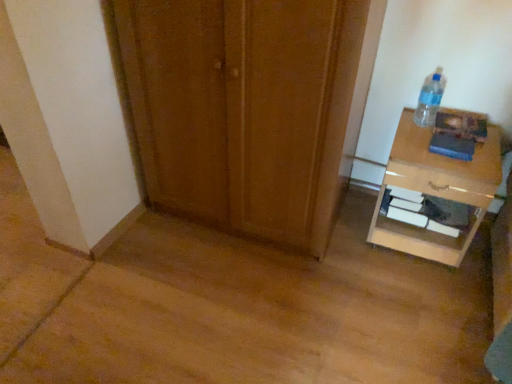
Question: From a real-world perspective, is clear plastic bottle at upper right located beneath light brown glossy nightstand at right?

Choices:
 (A) no
 (B) yes

Answer: (A)

Question: Can we say clear plastic bottle at upper right lies outside light brown glossy nightstand at right?

Choices:
 (A) yes
 (B) no

Answer: (A)

Question: Does clear plastic bottle at upper right have a lesser height compared to light brown glossy nightstand at right?

Choices:
 (A) yes
 (B) no

Answer: (A)

Question: Is clear plastic bottle at upper right wider than light brown glossy nightstand at right?

Choices:
 (A) yes
 (B) no

Answer: (B)

Question: Is clear plastic bottle at upper right facing towards light brown glossy nightstand at right?

Choices:
 (A) no
 (B) yes

Answer: (A)

Question: Does clear plastic bottle at upper right have a lesser width compared to light brown glossy nightstand at right?

Choices:
 (A) no
 (B) yes

Answer: (B)

Question: Is light brown glossy nightstand at right at the left side of wooden door at center?

Choices:
 (A) yes
 (B) no

Answer: (B)

Question: Is light brown glossy nightstand at right oriented away from wooden door at center?

Choices:
 (A) yes
 (B) no

Answer: (B)

Question: From the image's perspective, is light brown glossy nightstand at right beneath wooden door at center?

Choices:
 (A) no
 (B) yes

Answer: (B)

Question: From a real-world perspective, is light brown glossy nightstand at right physically below wooden door at center?

Choices:
 (A) yes
 (B) no

Answer: (A)

Question: Considering the relative sizes of light brown glossy nightstand at right and wooden door at center in the image provided, is light brown glossy nightstand at right taller than wooden door at center?

Choices:
 (A) yes
 (B) no

Answer: (B)

Question: Is light brown glossy nightstand at right positioned in front of wooden door at center?

Choices:
 (A) yes
 (B) no

Answer: (B)

Question: From a real-world perspective, does light brown glossy nightstand at right sit lower than clear plastic bottle at upper right?

Choices:
 (A) yes
 (B) no

Answer: (A)